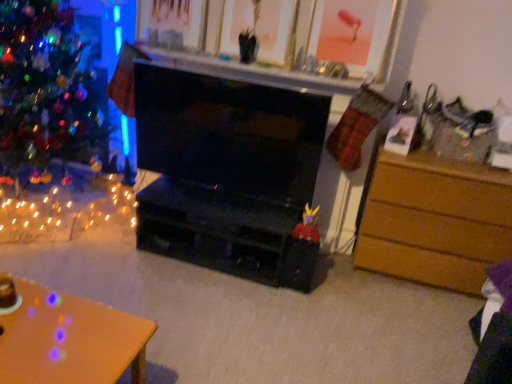
Question: Is shiny multicolored ornaments at left outside orange wood desk at lower left?

Choices:
 (A) no
 (B) yes

Answer: (B)

Question: Considering the relative positions of shiny multicolored ornaments at left and orange wood desk at lower left in the image provided, is shiny multicolored ornaments at left behind orange wood desk at lower left?

Choices:
 (A) yes
 (B) no

Answer: (A)

Question: Does shiny multicolored ornaments at left lie in front of orange wood desk at lower left?

Choices:
 (A) yes
 (B) no

Answer: (B)

Question: Is shiny multicolored ornaments at left far away from orange wood desk at lower left?

Choices:
 (A) no
 (B) yes

Answer: (B)

Question: Considering the relative sizes of shiny multicolored ornaments at left and orange wood desk at lower left in the image provided, is shiny multicolored ornaments at left bigger than orange wood desk at lower left?

Choices:
 (A) no
 (B) yes

Answer: (B)

Question: From the image's perspective, relative to orange wood desk at lower left, is black glossy fireplace at center above or below?

Choices:
 (A) below
 (B) above

Answer: (B)

Question: Which is correct: black glossy fireplace at center is inside orange wood desk at lower left, or outside of it?

Choices:
 (A) inside
 (B) outside

Answer: (B)

Question: Is black glossy fireplace at center taller or shorter than orange wood desk at lower left?

Choices:
 (A) tall
 (B) short

Answer: (A)

Question: Relative to orange wood desk at lower left, is black glossy fireplace at center in front or behind?

Choices:
 (A) behind
 (B) front

Answer: (A)

Question: From a real-world perspective, is black glossy fireplace at center positioned above or below brown wooden chest of drawers at right?

Choices:
 (A) above
 (B) below

Answer: (A)

Question: Looking at the image, does black glossy fireplace at center seem bigger or smaller compared to brown wooden chest of drawers at right?

Choices:
 (A) small
 (B) big

Answer: (A)

Question: In the image, is black glossy fireplace at center on the left side or the right side of brown wooden chest of drawers at right?

Choices:
 (A) left
 (B) right

Answer: (A)

Question: From the image's perspective, relative to brown wooden chest of drawers at right, is black glossy fireplace at center above or below?

Choices:
 (A) below
 (B) above

Answer: (B)

Question: Is point pos(104,379) positioned closer to the camera than point pos(192,147)?

Choices:
 (A) closer
 (B) farther

Answer: (A)

Question: From their relative heights in the image, would you say orange wood desk at lower left is taller or shorter than black glossy fireplace at center?

Choices:
 (A) tall
 (B) short

Answer: (B)